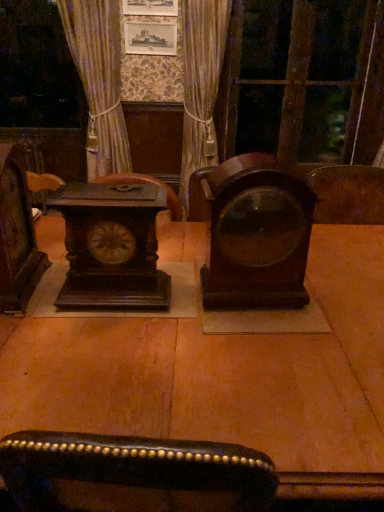
Question: Does mahogany wood alarm clock at center, the 2th alarm clock positioned from the left, appear on the right side of dark wood clock at left?

Choices:
 (A) yes
 (B) no

Answer: (A)

Question: From the image's perspective, is mahogany wood alarm clock at center, the 2th alarm clock positioned from the left, above dark wood clock at left?

Choices:
 (A) yes
 (B) no

Answer: (B)

Question: From a real-world perspective, is mahogany wood alarm clock at center, the 2th alarm clock positioned from the left, physically above dark wood clock at left?

Choices:
 (A) yes
 (B) no

Answer: (B)

Question: Is mahogany wood alarm clock at center, which is counted as the 1th alarm clock, starting from the right, not within dark wood clock at left?

Choices:
 (A) no
 (B) yes

Answer: (B)

Question: From their relative heights in the image, would you say velvet gold curtain at center is taller or shorter than transparent glass door at upper right?

Choices:
 (A) tall
 (B) short

Answer: (B)

Question: Considering the positions of velvet gold curtain at center and transparent glass door at upper right in the image, is velvet gold curtain at center wider or thinner than transparent glass door at upper right?

Choices:
 (A) wide
 (B) thin

Answer: (A)

Question: From the image's perspective, relative to transparent glass door at upper right, is velvet gold curtain at center above or below?

Choices:
 (A) below
 (B) above

Answer: (A)

Question: Would you say velvet gold curtain at center is inside or outside transparent glass door at upper right?

Choices:
 (A) inside
 (B) outside

Answer: (B)

Question: Is velvet gold curtain at center taller or shorter than mahogany wood alarm clock at center, the 2th alarm clock positioned from the left?

Choices:
 (A) tall
 (B) short

Answer: (A)

Question: Based on their sizes in the image, would you say velvet gold curtain at center is bigger or smaller than mahogany wood alarm clock at center, which is counted as the 1th alarm clock, starting from the right?

Choices:
 (A) small
 (B) big

Answer: (B)

Question: From the image's perspective, is velvet gold curtain at center above or below mahogany wood alarm clock at center, which is counted as the 1th alarm clock, starting from the right?

Choices:
 (A) above
 (B) below

Answer: (A)

Question: Considering the positions of velvet gold curtain at center and mahogany wood alarm clock at center, which is counted as the 1th alarm clock, starting from the right, in the image, is velvet gold curtain at center wider or thinner than mahogany wood alarm clock at center, which is counted as the 1th alarm clock, starting from the right,?

Choices:
 (A) thin
 (B) wide

Answer: (B)

Question: Considering the positions of point (266, 287) and point (26, 221), is point (266, 287) closer or farther from the camera than point (26, 221)?

Choices:
 (A) closer
 (B) farther

Answer: (A)

Question: Looking at their shapes, would you say mahogany wood alarm clock at center, which is counted as the 1th alarm clock, starting from the right, is wider or thinner than dark wood clock at left?

Choices:
 (A) wide
 (B) thin

Answer: (B)